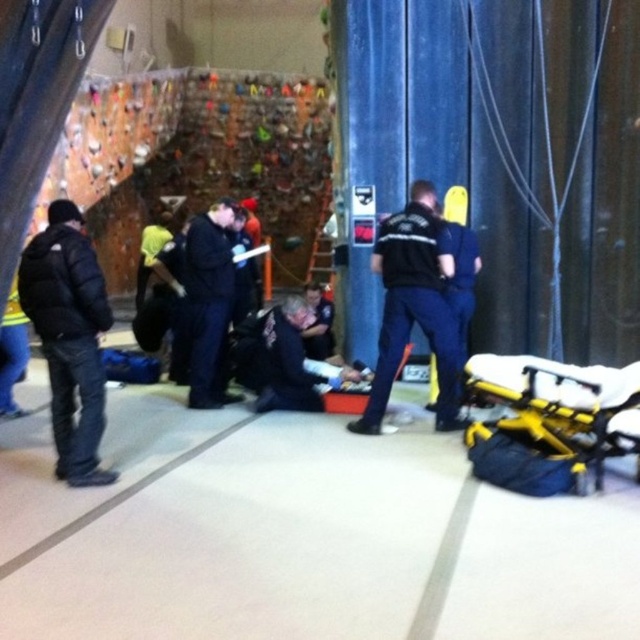
Does black matte jacket at left have a greater width compared to black fabric jacket at center?

Correct, the width of black matte jacket at left exceeds that of black fabric jacket at center.

Who is more forward, (x=77, y=292) or (x=202, y=332)?

Point (x=77, y=292) is more forward.

The width and height of the screenshot is (640, 640). Find the location of `black matte jacket at left`. black matte jacket at left is located at coordinates (68, 337).

Looking at this image, can you confirm if yellow metallic stretcher at center is smaller than dark blue uniform at center?

Indeed, yellow metallic stretcher at center has a smaller size compared to dark blue uniform at center.

Does yellow metallic stretcher at center appear over dark blue uniform at center?

Incorrect, yellow metallic stretcher at center is not positioned above dark blue uniform at center.

Is point (513, 484) positioned after point (435, 333)?

No, it is not.

This screenshot has height=640, width=640. In order to click on yellow metallic stretcher at center in this screenshot , I will do `click(550, 422)`.

Consider the image. Can you confirm if yellow metallic stretcher at center is positioned below blue uniform at center?

Correct, yellow metallic stretcher at center is located below blue uniform at center.

Who is more distant from viewer, (563, 445) or (464, 259)?

Positioned behind is point (464, 259).

Is point (609, 413) farther from viewer compared to point (460, 243)?

No, it is not.

Where is `yellow metallic stretcher at center`? yellow metallic stretcher at center is located at coordinates (550, 422).